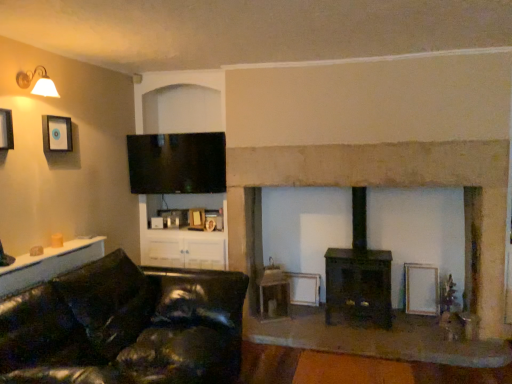
What do you see at coordinates (6, 130) in the screenshot? I see `matte black picture frame at upper left, acting as the third picture frame starting from the back` at bounding box center [6, 130].

In order to face matte white lamp at upper left, should I rotate leftwards or rightwards?

A 26.873 degree turn to the left will do.

Where is `black leather couch at lower left`? The image size is (512, 384). black leather couch at lower left is located at coordinates (125, 326).

What do you see at coordinates (59, 133) in the screenshot? I see `matte black picture frame at upper left, arranged as the 3th picture frame when ordered from the bottom` at bounding box center [59, 133].

Where is `flat screen tv at upper center`? The height and width of the screenshot is (384, 512). flat screen tv at upper center is located at coordinates point(177,163).

Considering the relative sizes of white matte picture frame at lower right, which is the 3th picture frame in front-to-back order, and matte black picture frame at upper left, the second picture frame from the right, in the image provided, is white matte picture frame at lower right, which is the 3th picture frame in front-to-back order, shorter than matte black picture frame at upper left, the second picture frame from the right,?

No, white matte picture frame at lower right, which is the 3th picture frame in front-to-back order, is not shorter than matte black picture frame at upper left, the second picture frame from the right.

Which is correct: white matte picture frame at lower right, placed as the 3th picture frame when sorted from left to right, is inside matte black picture frame at upper left, the 2th picture frame from the back, or outside of it?

white matte picture frame at lower right, placed as the 3th picture frame when sorted from left to right, is spatially situated outside matte black picture frame at upper left, the 2th picture frame from the back.

Is white matte picture frame at lower right, the first picture frame positioned from the right, facing away from matte black picture frame at upper left, the second picture frame from the right?

No, white matte picture frame at lower right, the first picture frame positioned from the right, is not facing away from matte black picture frame at upper left, the second picture frame from the right.

Which object is positioned more to the right, white glossy cabinet at lower left or matte white lamp at upper left?

Positioned to the right is white glossy cabinet at lower left.

Would you say matte white lamp at upper left is part of white glossy cabinet at lower left's contents?

Definitely not — matte white lamp at upper left is not inside white glossy cabinet at lower left.

Considering their positions, is white glossy cabinet at lower left located in front of or behind matte white lamp at upper left?

white glossy cabinet at lower left is in front of matte white lamp at upper left.

Is point (56, 274) positioned after point (45, 88)?

No, (56, 274) is closer to viewer.

Based on the photo, is flat screen tv at upper center spatially inside dark brown wood fireplace at center, or outside of it?

flat screen tv at upper center is located beyond the bounds of dark brown wood fireplace at center.

Is flat screen tv at upper center wider than dark brown wood fireplace at center?

No, flat screen tv at upper center is not wider than dark brown wood fireplace at center.

Between flat screen tv at upper center and dark brown wood fireplace at center, which one is positioned in front?

dark brown wood fireplace at center is more forward.

Is flat screen tv at upper center facing away from dark brown wood fireplace at center?

No.

Considering the relative positions of dark brown wood fireplace at center and flat screen tv at upper center in the image provided, is dark brown wood fireplace at center in front of flat screen tv at upper center?

Yes, dark brown wood fireplace at center is closer to the viewer.

Looking at this image, is dark brown wood fireplace at center oriented towards flat screen tv at upper center?

No, dark brown wood fireplace at center is not facing towards flat screen tv at upper center.

Looking at this image, would you say dark brown wood fireplace at center contains flat screen tv at upper center?

That's incorrect, flat screen tv at upper center is not inside dark brown wood fireplace at center.

Considering the relative sizes of dark brown wood fireplace at center and flat screen tv at upper center in the image provided, is dark brown wood fireplace at center shorter than flat screen tv at upper center?

No, dark brown wood fireplace at center is not shorter than flat screen tv at upper center.

Could you measure the distance between matte black picture frame at upper left, the second picture frame viewed from the left, and matte white lamp at upper left?

The distance of matte black picture frame at upper left, the second picture frame viewed from the left, from matte white lamp at upper left is 10.42 inches.

Is matte black picture frame at upper left, the 2th picture frame from the back, facing towards matte white lamp at upper left?

No, matte black picture frame at upper left, the 2th picture frame from the back, does not turn towards matte white lamp at upper left.

Is the depth of matte black picture frame at upper left, arranged as the 3th picture frame when ordered from the bottom, less than that of matte white lamp at upper left?

No, it is not.

Is matte white lamp at upper left completely or partially inside matte black picture frame at upper left, which is the 1th picture frame in top-to-bottom order?

No, matte black picture frame at upper left, which is the 1th picture frame in top-to-bottom order, does not contain matte white lamp at upper left.

Are white glossy cabinet at lower left and dark brown wood fireplace at center beside each other?

No, white glossy cabinet at lower left is not beside dark brown wood fireplace at center.

From a real-world perspective, between white glossy cabinet at lower left and dark brown wood fireplace at center, who is vertically higher?

dark brown wood fireplace at center is physically above.

Identify the location of cabinetry on the left of dark brown wood fireplace at center. The image size is (512, 384). (49, 264).

Which is behind, point (57, 272) or point (384, 161)?

The point (384, 161) is more distant.

Is flat screen tv at upper center turned away from matte white lamp at upper left?

No, matte white lamp at upper left is not at the back of flat screen tv at upper center.

What's the angular difference between flat screen tv at upper center and matte white lamp at upper left's facing directions?

There is a 88.9-degree angle between the facing directions of flat screen tv at upper center and matte white lamp at upper left.

Who is more distant, flat screen tv at upper center or matte white lamp at upper left?

flat screen tv at upper center is further from the camera.

Image resolution: width=512 pixels, height=384 pixels. What are the coordinates of `picture frame located behind the matte black picture frame at upper left, the second picture frame viewed from the left` in the screenshot? It's located at (421, 289).

You are a GUI agent. You are given a task and a screenshot of the screen. Output one action in this format:
    pyautogui.click(x=<x>, y=<y>)
    Task: Click on the cabinetry in front of the matte white lamp at upper left
    This screenshot has height=384, width=512.
    Given the screenshot: What is the action you would take?
    [49, 264]

Estimate the real-world distances between objects in this image. Which object is further from matte black picture frame at upper left, arranged as the 3th picture frame when ordered from the bottom, dark brown wood fireplace at center or white matte picture frame at lower right, placed as the 3th picture frame when sorted from left to right?

white matte picture frame at lower right, placed as the 3th picture frame when sorted from left to right, is positioned further to the anchor matte black picture frame at upper left, arranged as the 3th picture frame when ordered from the bottom.

Based on their spatial positions, is wooden table at center or white glossy cabinet at lower left further from white matte picture frame at lower right, arranged as the 1th picture frame when ordered from the bottom?

A: The object further to white matte picture frame at lower right, arranged as the 1th picture frame when ordered from the bottom, is white glossy cabinet at lower left.

Considering their positions, is matte black picture frame at upper left, acting as the second picture frame starting from the bottom, positioned closer to matte white lamp at upper left than dark brown wood fireplace at center?

matte black picture frame at upper left, acting as the second picture frame starting from the bottom, is closer to matte white lamp at upper left.

Which object lies further to the anchor point dark brown wood burning stove at center, matte black picture frame at upper left, acting as the third picture frame starting from the back, or wooden table at center?

Based on the image, matte black picture frame at upper left, acting as the third picture frame starting from the back, appears to be further to dark brown wood burning stove at center.

Estimate the real-world distances between objects in this image. Which object is further from black leather couch at lower left, wooden table at center or dark brown wood burning stove at center?

dark brown wood burning stove at center.

From the image, which object appears to be nearer to dark brown wood burning stove at center, dark brown wood fireplace at center or flat screen tv at upper center?

dark brown wood fireplace at center is closer to dark brown wood burning stove at center.

Based on their spatial positions, is black leather couch at lower left or matte black picture frame at upper left, the 1th picture frame viewed from the front, further from white glossy cabinet at lower left?

Based on the image, matte black picture frame at upper left, the 1th picture frame viewed from the front, appears to be further to white glossy cabinet at lower left.

Looking at the image, which one is located further to dark brown wood burning stove at center, white matte picture frame at lower right, which is the 3th picture frame in front-to-back order, or wooden table at center?

wooden table at center lies further to dark brown wood burning stove at center than the other object.

At what (x,y) coordinates should I click in order to perform the action: click on wood burning stove between matte black picture frame at upper left, the 2th picture frame from the back, and dark brown wood fireplace at center, in the horizontal direction. Please return your answer as a coordinate pair (x, y). Looking at the image, I should click on (359, 275).

Find the location of a particular element. table situated between matte black picture frame at upper left, arranged as the 3th picture frame when ordered from the bottom, and dark brown wood burning stove at center from left to right is located at coordinates (274, 295).

At what (x,y) coordinates should I click in order to perform the action: click on lamp located between matte black picture frame at upper left, acting as the second picture frame starting from the front, and white matte picture frame at lower right, the first picture frame positioned from the right, in the left-right direction. Please return your answer as a coordinate pair (x, y). Looking at the image, I should click on (37, 82).

Locate an element on the screen. Image resolution: width=512 pixels, height=384 pixels. studio couch between matte white lamp at upper left and white matte picture frame at lower right, which is the 1th picture frame in back-to-front order, from left to right is located at coordinates (125, 326).